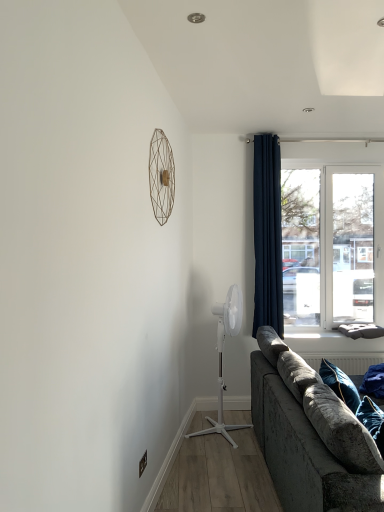
This screenshot has width=384, height=512. I want to click on white plastic fan at center, the 2th mechanical fan viewed from the left, so click(221, 357).

Describe the element at coordinates (221, 357) in the screenshot. This screenshot has height=512, width=384. I see `white plastic fan at center, the 2th mechanical fan in the top-to-bottom sequence` at that location.

Locate an element on the screen. This screenshot has width=384, height=512. transparent glass window at upper right is located at coordinates (332, 234).

At what (x,y) coordinates should I click in order to perform the action: click on matte gold wire at upper center, placed as the 2th mechanical fan when sorted from right to left. Please return your answer as a coordinate pair (x, y). Looking at the image, I should click on (161, 176).

Where is `velvet grey couch at lower right`? velvet grey couch at lower right is located at coordinates (310, 435).

What do you see at coordinates (267, 234) in the screenshot? This screenshot has width=384, height=512. I see `navy blue fabric curtain at right` at bounding box center [267, 234].

Where is `white plastic fan at center, which ranks as the first mechanical fan in right-to-left order`? This screenshot has width=384, height=512. white plastic fan at center, which ranks as the first mechanical fan in right-to-left order is located at coordinates (221, 357).

Consider the image. Considering the sizes of objects navy blue fabric curtain at right and white plastic fan at center, which ranks as the first mechanical fan in right-to-left order, in the image provided, who is thinner, navy blue fabric curtain at right or white plastic fan at center, which ranks as the first mechanical fan in right-to-left order,?

navy blue fabric curtain at right is thinner.

The image size is (384, 512). I want to click on curtain above the white plastic fan at center, positioned as the second mechanical fan in front-to-back order (from a real-world perspective), so click(267, 234).

Is navy blue fabric curtain at right looking in the opposite direction of white plastic fan at center, which appears as the 1th mechanical fan when viewed from the back?

That's not correct — navy blue fabric curtain at right is not looking away from white plastic fan at center, which appears as the 1th mechanical fan when viewed from the back.

Is navy blue fabric curtain at right directly adjacent to white plastic fan at center, which ranks as the first mechanical fan in right-to-left order?

navy blue fabric curtain at right is not next to white plastic fan at center, which ranks as the first mechanical fan in right-to-left order, and they're not touching.

Would you say matte gold wire at upper center, the 2th mechanical fan ordered from the bottom, is outside velvet grey couch at lower right?

Yes, matte gold wire at upper center, the 2th mechanical fan ordered from the bottom, is outside of velvet grey couch at lower right.

Is matte gold wire at upper center, which is the first mechanical fan from left to right, not close to velvet grey couch at lower right?

Yes, matte gold wire at upper center, which is the first mechanical fan from left to right, and velvet grey couch at lower right are quite far apart.

Considering the positions of point (149, 185) and point (279, 350), is point (149, 185) closer or farther from the camera than point (279, 350)?

Point (149, 185) is closer to the camera than point (279, 350).

What's the angular difference between matte gold wire at upper center, which is the first mechanical fan from left to right, and velvet grey couch at lower right's facing directions?

9.56 degrees.

In the scene shown: Is matte gold wire at upper center, placed as the 2th mechanical fan when sorted from right to left, surrounding white plastic fan at center, placed as the first mechanical fan when sorted from bottom to top?

No.

Is there a large distance between matte gold wire at upper center, the 2th mechanical fan viewed from the back, and white plastic fan at center, which ranks as the first mechanical fan in right-to-left order?

Indeed, matte gold wire at upper center, the 2th mechanical fan viewed from the back, is not near white plastic fan at center, which ranks as the first mechanical fan in right-to-left order.

Consider the image. Which of these two, matte gold wire at upper center, the 2th mechanical fan viewed from the back, or white plastic fan at center, the 2th mechanical fan viewed from the left, stands shorter?

matte gold wire at upper center, the 2th mechanical fan viewed from the back, is shorter.

Is matte gold wire at upper center, the 2th mechanical fan ordered from the bottom, bigger than white plastic fan at center, the 2th mechanical fan in the top-to-bottom sequence?

No, matte gold wire at upper center, the 2th mechanical fan ordered from the bottom, is not bigger than white plastic fan at center, the 2th mechanical fan in the top-to-bottom sequence.

Between transparent glass window at upper right and matte gold wire at upper center, marked as the 1th mechanical fan in a front-to-back arrangement, which one has smaller size?

matte gold wire at upper center, marked as the 1th mechanical fan in a front-to-back arrangement.

Is transparent glass window at upper right thinner than matte gold wire at upper center, the 2th mechanical fan viewed from the back?

Incorrect, the width of transparent glass window at upper right is not less than that of matte gold wire at upper center, the 2th mechanical fan viewed from the back.

Is the depth of transparent glass window at upper right less than that of matte gold wire at upper center, placed as the 2th mechanical fan when sorted from right to left?

No.

Which point is more forward, [332,231] or [161,163]?

The point [161,163] is more forward.

In the scene shown: Can you confirm if matte gold wire at upper center, which ranks as the first mechanical fan in top-to-bottom order, is thinner than transparent glass window at upper right?

Yes, matte gold wire at upper center, which ranks as the first mechanical fan in top-to-bottom order, is thinner than transparent glass window at upper right.

Is matte gold wire at upper center, marked as the 1th mechanical fan in a front-to-back arrangement, turned away from transparent glass window at upper right?

That's not correct — matte gold wire at upper center, marked as the 1th mechanical fan in a front-to-back arrangement, is not looking away from transparent glass window at upper right.

Is the depth of matte gold wire at upper center, the 2th mechanical fan ordered from the bottom, greater than that of transparent glass window at upper right?

No, the depth of matte gold wire at upper center, the 2th mechanical fan ordered from the bottom, is less than that of transparent glass window at upper right.

What's the angular difference between matte gold wire at upper center, which is the first mechanical fan from left to right, and transparent glass window at upper right's facing directions?

matte gold wire at upper center, which is the first mechanical fan from left to right, and transparent glass window at upper right are facing 79.3 degrees away from each other.

From the image's perspective, which one is positioned higher, transparent glass window at upper right or white plastic fan at center, positioned as the second mechanical fan in front-to-back order?

From the image's view, transparent glass window at upper right is above.

Considering the relative positions of transparent glass window at upper right and white plastic fan at center, which appears as the 1th mechanical fan when viewed from the back, in the image provided, is transparent glass window at upper right to the left or to the right of white plastic fan at center, which appears as the 1th mechanical fan when viewed from the back,?

transparent glass window at upper right is positioned on white plastic fan at center, which appears as the 1th mechanical fan when viewed from the back,'s right side.

Is transparent glass window at upper right closer to camera compared to white plastic fan at center, placed as the first mechanical fan when sorted from bottom to top?

No, transparent glass window at upper right is further to the viewer.

Is white plastic fan at center, positioned as the second mechanical fan in front-to-back order, closer to the viewer compared to navy blue fabric curtain at right?

That is True.

How different are the orientations of white plastic fan at center, positioned as the second mechanical fan in front-to-back order, and navy blue fabric curtain at right in degrees?

The angle between the facing direction of white plastic fan at center, positioned as the second mechanical fan in front-to-back order, and the facing direction of navy blue fabric curtain at right is 69.6 degrees.

Find the location of `mechanical fan beneath the navy blue fabric curtain at right (from a real-world perspective)`. mechanical fan beneath the navy blue fabric curtain at right (from a real-world perspective) is located at coordinates 221,357.

I want to click on the 1st mechanical fan to the left of the navy blue fabric curtain at right, starting your count from the anchor, so click(x=221, y=357).

What are the coordinates of `the 2nd mechanical fan above the velvet grey couch at lower right (from the image's perspective)` in the screenshot? It's located at (161, 176).

Looking at the image, which one is located further to white plastic fan at center, positioned as the second mechanical fan in front-to-back order, velvet grey couch at lower right or matte gold wire at upper center, which is the first mechanical fan from left to right?

matte gold wire at upper center, which is the first mechanical fan from left to right.

Based on their spatial positions, is matte gold wire at upper center, the 2th mechanical fan ordered from the bottom, or velvet grey couch at lower right closer to white plastic fan at center, which ranks as the first mechanical fan in right-to-left order?

Based on the image, velvet grey couch at lower right appears to be nearer to white plastic fan at center, which ranks as the first mechanical fan in right-to-left order.

Estimate the real-world distances between objects in this image. Which object is closer to white plastic fan at center, which ranks as the first mechanical fan in right-to-left order, transparent glass window at upper right or navy blue fabric curtain at right?

navy blue fabric curtain at right is closer to white plastic fan at center, which ranks as the first mechanical fan in right-to-left order.

From the image, which object appears to be nearer to transparent glass window at upper right, navy blue fabric curtain at right or velvet grey couch at lower right?

navy blue fabric curtain at right is positioned closer to the anchor transparent glass window at upper right.

Based on their spatial positions, is white plastic fan at center, positioned as the second mechanical fan in front-to-back order, or navy blue fabric curtain at right further from matte gold wire at upper center, placed as the 2th mechanical fan when sorted from right to left?

white plastic fan at center, positioned as the second mechanical fan in front-to-back order, lies further to matte gold wire at upper center, placed as the 2th mechanical fan when sorted from right to left, than the other object.

Which object lies further to the anchor point velvet grey couch at lower right, matte gold wire at upper center, which is the first mechanical fan from left to right, or transparent glass window at upper right?

transparent glass window at upper right is positioned further to the anchor velvet grey couch at lower right.

Which object lies further to the anchor point transparent glass window at upper right, matte gold wire at upper center, marked as the 1th mechanical fan in a front-to-back arrangement, or white plastic fan at center, the 2th mechanical fan in the top-to-bottom sequence?

Among the two, matte gold wire at upper center, marked as the 1th mechanical fan in a front-to-back arrangement, is located further to transparent glass window at upper right.

Consider the image. Which object lies further to the anchor point matte gold wire at upper center, which ranks as the first mechanical fan in top-to-bottom order, transparent glass window at upper right or velvet grey couch at lower right?

Among the two, transparent glass window at upper right is located further to matte gold wire at upper center, which ranks as the first mechanical fan in top-to-bottom order.

Locate an element on the screen. The image size is (384, 512). curtain located between velvet grey couch at lower right and transparent glass window at upper right in the depth direction is located at coordinates pos(267,234).

The image size is (384, 512). Identify the location of mechanical fan between velvet grey couch at lower right and white plastic fan at center, which appears as the 1th mechanical fan when viewed from the back, in the front-back direction. (161, 176).

This screenshot has height=512, width=384. I want to click on curtain between matte gold wire at upper center, the 2th mechanical fan viewed from the back, and white plastic fan at center, the 2th mechanical fan viewed from the left, vertically, so click(267, 234).

Find the location of `curtain positioned between matte gold wire at upper center, the 2th mechanical fan ordered from the bottom, and transparent glass window at upper right from near to far`. curtain positioned between matte gold wire at upper center, the 2th mechanical fan ordered from the bottom, and transparent glass window at upper right from near to far is located at coordinates (267, 234).